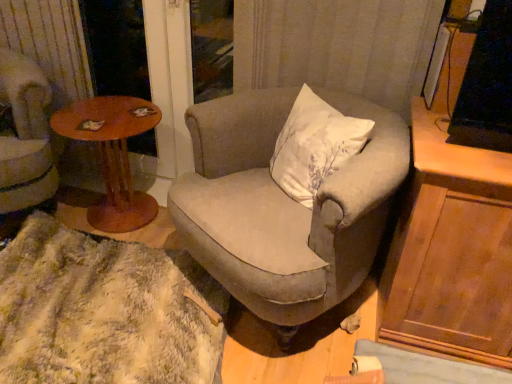
Where is `brown wooden screen door at upper left`? brown wooden screen door at upper left is located at coordinates (134, 67).

What is the approximate height of velvet beige armchair at left, acting as the second chair starting from the right?

The height of velvet beige armchair at left, acting as the second chair starting from the right, is 29.78 inches.

What do you see at coordinates (25, 135) in the screenshot? Image resolution: width=512 pixels, height=384 pixels. I see `velvet beige armchair at left, the first chair in the left-to-right sequence` at bounding box center [25, 135].

The width and height of the screenshot is (512, 384). What are the coordinates of `wooden cabinet at right` in the screenshot? It's located at (451, 251).

From the image's perspective, is wooden cabinet at right beneath wooden round table at left?

Indeed, from the image's perspective, wooden cabinet at right is shown beneath wooden round table at left.

Is wooden cabinet at right to the left or to the right of wooden round table at left in the image?

Clearly, wooden cabinet at right is on the right of wooden round table at left in the image.

Considering the sizes of wooden cabinet at right and wooden round table at left in the image, is wooden cabinet at right taller or shorter than wooden round table at left?

Considering their sizes, wooden cabinet at right has more height than wooden round table at left.

How much distance is there between wooden cabinet at right and wooden round table at left?

A distance of 1.25 meters exists between wooden cabinet at right and wooden round table at left.

Which object is thinner, wooden cabinet at right or brown wooden screen door at upper left?

Thinner between the two is brown wooden screen door at upper left.

How much distance is there between wooden cabinet at right and brown wooden screen door at upper left?

They are 1.36 meters apart.

This screenshot has height=384, width=512. In order to click on screen door above the wooden cabinet at right (from the image's perspective) in this screenshot , I will do `click(134, 67)`.

From a real-world perspective, is wooden cabinet at right physically located above or below brown wooden screen door at upper left?

In terms of real-world spatial position, wooden cabinet at right is below brown wooden screen door at upper left.

Would you say wooden round table at left is to the left or to the right of velvet beige armchair at left, acting as the second chair starting from the right, in the picture?

Clearly, wooden round table at left is on the right of velvet beige armchair at left, acting as the second chair starting from the right, in the image.

In terms of height, does wooden round table at left look taller or shorter compared to velvet beige armchair at left, the first chair in the left-to-right sequence?

Clearly, wooden round table at left is shorter compared to velvet beige armchair at left, the first chair in the left-to-right sequence.

Consider the image. Which is closer, (104, 113) or (20, 103)?

The point (20, 103) is closer to the camera.

Does wooden cabinet at right have a greater height compared to velvet beige armchair at left, the first chair in the left-to-right sequence?

No.

Where is `cabinetry on the right of the velvet beige armchair at left, the first chair in the left-to-right sequence`? The width and height of the screenshot is (512, 384). cabinetry on the right of the velvet beige armchair at left, the first chair in the left-to-right sequence is located at coordinates (451, 251).

Considering the relative positions of wooden cabinet at right and velvet beige armchair at left, acting as the second chair starting from the right, in the image provided, is wooden cabinet at right to the left of velvet beige armchair at left, acting as the second chair starting from the right, from the viewer's perspective?

In fact, wooden cabinet at right is to the right of velvet beige armchair at left, acting as the second chair starting from the right.

Is fuzzy white rug at lower left looking in the opposite direction of wooden round table at left?

Yes, fuzzy white rug at lower left is positioned with its back facing wooden round table at left.

Locate an element on the screen. blanket lying in front of the wooden round table at left is located at coordinates (104, 311).

Is fuzzy white rug at lower left with wooden round table at left?

fuzzy white rug at lower left is not next to wooden round table at left, and they're not touching.

Does fuzzy white rug at lower left have a smaller size compared to wooden round table at left?

No, fuzzy white rug at lower left is not smaller than wooden round table at left.

In the scene shown: Which is nearer, (26, 335) or (449, 255)?

The point (449, 255) is in front.

In terms of width, does fuzzy white rug at lower left look wider or thinner when compared to wooden cabinet at right?

Clearly, fuzzy white rug at lower left has more width compared to wooden cabinet at right.

In the scene shown: Is fuzzy white rug at lower left facing towards wooden cabinet at right?

No, fuzzy white rug at lower left is not turned towards wooden cabinet at right.

Is wooden round table at left smaller than textured beige armchair at center, which is the 2th chair in left-to-right order?

Correct, wooden round table at left occupies less space than textured beige armchair at center, which is the 2th chair in left-to-right order.

Looking at this image, could you tell me if wooden round table at left is facing textured beige armchair at center, which is the 2th chair in left-to-right order?

No, wooden round table at left is not aimed at textured beige armchair at center, which is the 2th chair in left-to-right order.

From a real-world perspective, is wooden round table at left positioned above or below textured beige armchair at center, which is the 2th chair in left-to-right order?

From a real-world perspective, wooden round table at left is physically below textured beige armchair at center, which is the 2th chair in left-to-right order.

Identify the location of cabinetry lying in front of the wooden round table at left. (451, 251).

Identify the location of screen door behind the wooden cabinet at right. (134, 67).

Considering their positions, is textured beige armchair at center, which ranks as the 1th chair in right-to-left order, positioned further to brown wooden screen door at upper left than wooden round table at left?

textured beige armchair at center, which ranks as the 1th chair in right-to-left order, is further to brown wooden screen door at upper left.

In the scene shown: Based on their spatial positions, is velvet beige armchair at left, the first chair in the left-to-right sequence, or wooden cabinet at right further from brown wooden screen door at upper left?

wooden cabinet at right is positioned further to the anchor brown wooden screen door at upper left.

Considering their positions, is velvet beige armchair at left, acting as the second chair starting from the right, positioned closer to wooden round table at left than textured beige armchair at center, which is the 2th chair in left-to-right order?

velvet beige armchair at left, acting as the second chair starting from the right, is positioned closer to the anchor wooden round table at left.

From the image, which object appears to be farther from brown wooden screen door at upper left, wooden round table at left or fuzzy white rug at lower left?

fuzzy white rug at lower left is further to brown wooden screen door at upper left.

Consider the image. When comparing their distances from brown wooden screen door at upper left, does wooden round table at left or textured beige armchair at center, which is the 2th chair in left-to-right order, seem further?

textured beige armchair at center, which is the 2th chair in left-to-right order.

Looking at the image, which one is located closer to velvet beige armchair at left, the first chair in the left-to-right sequence, brown wooden screen door at upper left or wooden round table at left?

The object closer to velvet beige armchair at left, the first chair in the left-to-right sequence, is wooden round table at left.

Estimate the real-world distances between objects in this image. Which object is further from wooden round table at left, brown wooden screen door at upper left or fuzzy white rug at lower left?

Based on the image, fuzzy white rug at lower left appears to be further to wooden round table at left.

Estimate the real-world distances between objects in this image. Which object is closer to brown wooden screen door at upper left, wooden cabinet at right or wooden round table at left?

wooden round table at left lies closer to brown wooden screen door at upper left than the other object.

The image size is (512, 384). I want to click on coffee table between velvet beige armchair at left, acting as the second chair starting from the right, and fuzzy white rug at lower left in the up-down direction, so click(113, 155).

Where is `chair between wooden round table at left and wooden cabinet at right in the horizontal direction`? The image size is (512, 384). chair between wooden round table at left and wooden cabinet at right in the horizontal direction is located at coordinates (284, 206).

At what (x,y) coordinates should I click in order to perform the action: click on screen door located between velvet beige armchair at left, acting as the second chair starting from the right, and textured beige armchair at center, which ranks as the 1th chair in right-to-left order, in the left-right direction. Please return your answer as a coordinate pair (x, y). Looking at the image, I should click on (134, 67).

Locate an element on the screen. The height and width of the screenshot is (384, 512). blanket between wooden round table at left and textured beige armchair at center, which ranks as the 1th chair in right-to-left order, in the horizontal direction is located at coordinates (104, 311).